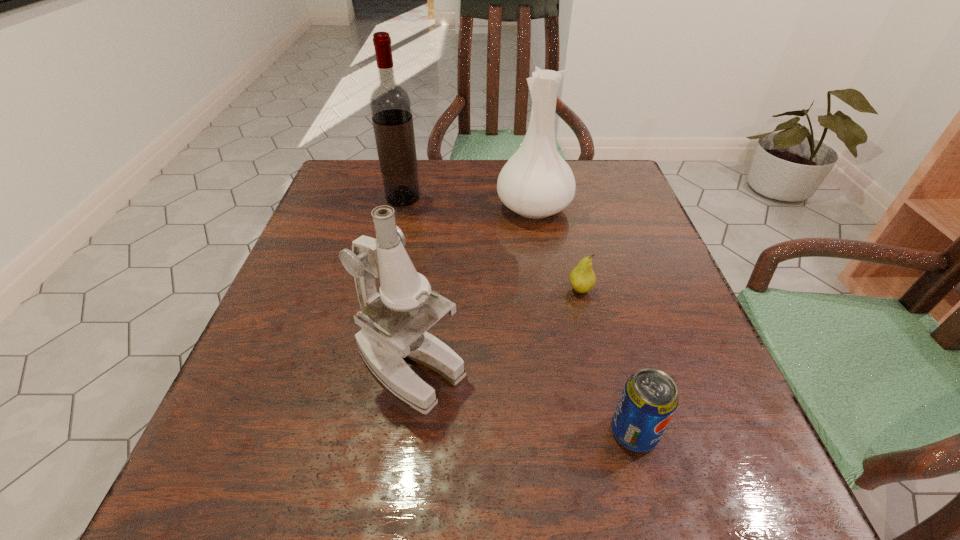
Find the location of a particular element. This screenshot has height=540, width=960. the tallest object is located at coordinates (390, 104).

At what (x,y) coordinates should I click in order to perform the action: click on vase. Please return your answer as a coordinate pair (x, y). The image size is (960, 540). Looking at the image, I should click on (536, 182).

Identify the location of microscope. Image resolution: width=960 pixels, height=540 pixels. (387, 335).

You are a GUI agent. You are given a task and a screenshot of the screen. Output one action in this format:
    pyautogui.click(x=<x>, y=<y>)
    Task: Click on the soda
    
    Given the screenshot: What is the action you would take?
    pyautogui.click(x=649, y=399)

The height and width of the screenshot is (540, 960). Identify the location of the third nearest object. (582, 278).

Image resolution: width=960 pixels, height=540 pixels. What are the coordinates of `pear` in the screenshot? It's located at (582, 278).

At what (x,y) coordinates should I click in order to perform the action: click on vacant area situated on the left of the tallest object. Please return your answer as a coordinate pair (x, y). Looking at the image, I should click on [x=365, y=198].

Locate an element on the screen. The image size is (960, 540). free space located 0.240m on the left of the vase is located at coordinates (395, 207).

Identify the location of vacant space situated 0.150m on the front of the microscope. The width and height of the screenshot is (960, 540). (387, 526).

Identify the location of vacant space located on the back of the soda. The width and height of the screenshot is (960, 540). (611, 347).